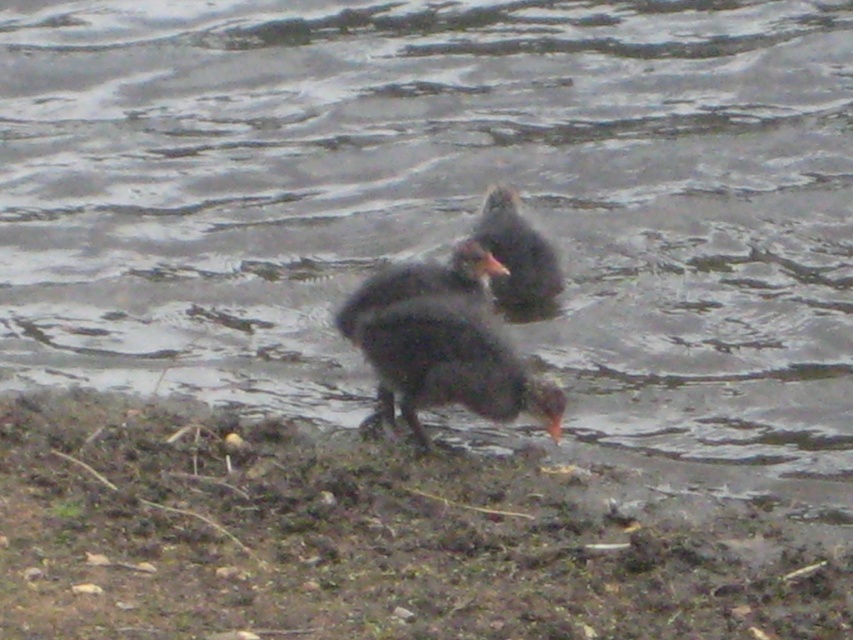
Between brown muddy ground at lower center and dark feathered bird at center, which one has less height?

With less height is brown muddy ground at lower center.

Is point (102, 552) positioned in front of point (366, 348)?

Yes, point (102, 552) is in front of point (366, 348).

Image resolution: width=853 pixels, height=640 pixels. Find the location of `brown muddy ground at lower center`. brown muddy ground at lower center is located at coordinates (361, 541).

Is point (554, 296) behind point (494, 275)?

Yes, it is.

Measure the distance between dark gray feathers duck at center and camera.

They are 4.77 meters apart.

Locate an element on the screen. The width and height of the screenshot is (853, 640). dark gray feathers duck at center is located at coordinates (517, 257).

Who is lower down, dark feathered bird at center or dark gray feathers duck at center?

dark feathered bird at center is below.

Describe the element at coordinates (450, 364) in the screenshot. I see `dark feathered bird at center` at that location.

Image resolution: width=853 pixels, height=640 pixels. Describe the element at coordinates (450, 364) in the screenshot. I see `dark feathered bird at center` at that location.

Where is `dark feathered bird at center`? The height and width of the screenshot is (640, 853). dark feathered bird at center is located at coordinates (450, 364).